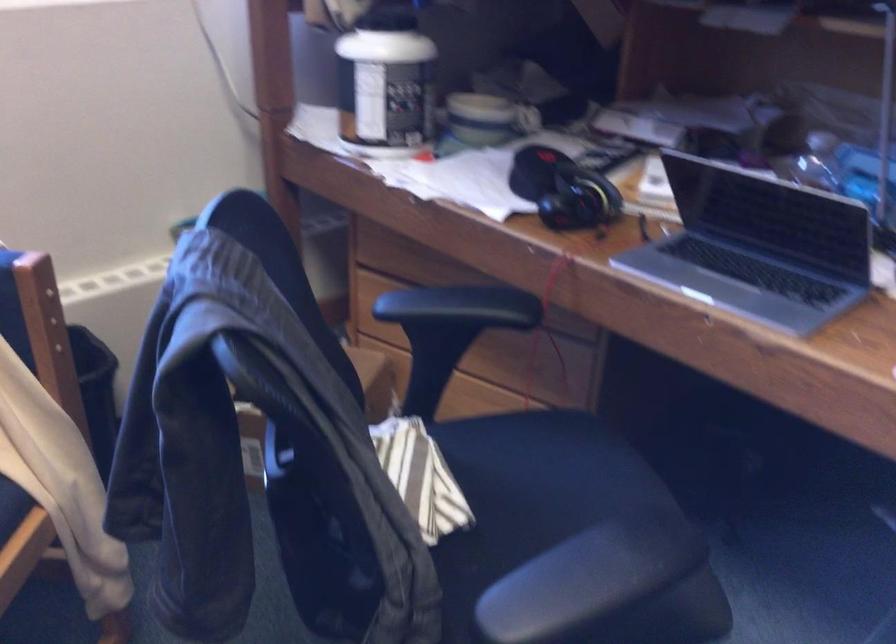
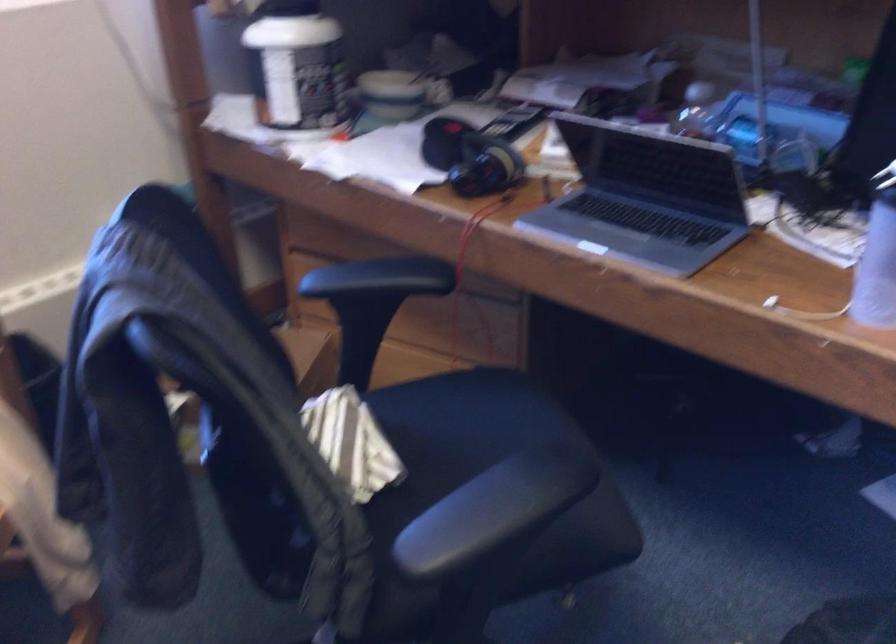
Question: The camera is either moving clockwise (left) or counter-clockwise (right) around the object. The first image is from the beginning of the video and the second image is from the end. Is the camera moving left or right when shooting the video?

Choices:
 (A) Left
 (B) Right

Answer: (A)